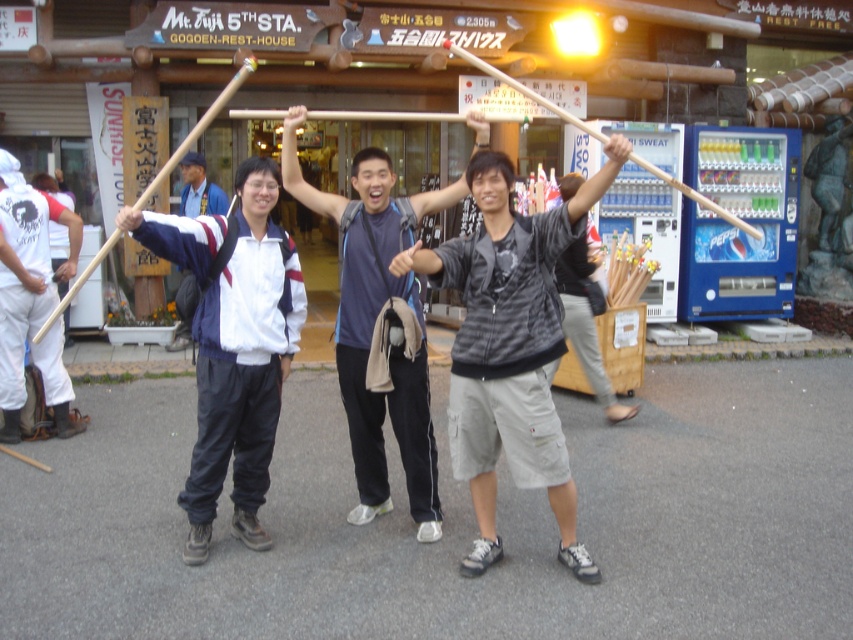
Question: Which is farther from the white jacket at center?

Choices:
 (A) dark blue fabric shirt at center
 (B) gray cotton shorts at center
 (C) white matte jacket at center

Answer: (B)

Question: Can you confirm if dark blue fabric shirt at center is positioned above white jacket at center?

Choices:
 (A) no
 (B) yes

Answer: (A)

Question: Which point is closer to the camera taking this photo?

Choices:
 (A) (264, 321)
 (B) (25, 268)
 (C) (526, 376)
 (D) (206, 209)

Answer: (C)

Question: Which point is farther to the camera?

Choices:
 (A) (202, 420)
 (B) (503, 193)
 (C) (387, 204)

Answer: (C)

Question: Can you confirm if dark blue fabric shirt at center is positioned to the right of white jacket at center?

Choices:
 (A) no
 (B) yes

Answer: (B)

Question: Can you confirm if white matte jacket at center is smaller than white jacket at center?

Choices:
 (A) no
 (B) yes

Answer: (A)